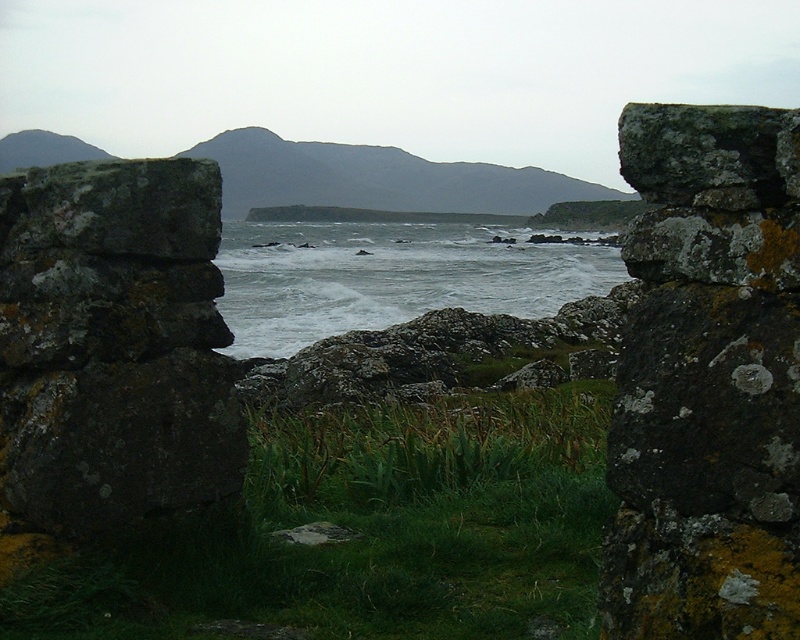
Is point (376, 317) positioned in front of point (712, 108)?

No, (376, 317) is behind (712, 108).

Is white frothy water at center wider than lichen-covered rock at upper right?

Yes, white frothy water at center is wider than lichen-covered rock at upper right.

Who is more forward, (478,236) or (700,134)?

Point (700,134)

What are the coordinates of `white frothy water at center` in the screenshot? It's located at (389, 276).

Based on the photo, between rusty stone wall at right and lichen-covered rock at upper right, which one appears on the right side from the viewer's perspective?

rusty stone wall at right

From the picture: Who is positioned more to the left, rusty stone wall at right or lichen-covered rock at upper right?

Positioned to the left is lichen-covered rock at upper right.

The height and width of the screenshot is (640, 800). Describe the element at coordinates (708, 380) in the screenshot. I see `rusty stone wall at right` at that location.

This screenshot has width=800, height=640. I want to click on rusty stone wall at right, so click(x=708, y=380).

Who is positioned more to the right, green grassy patch at center or white frothy water at center?

green grassy patch at center is more to the right.

What are the coordinates of `green grassy patch at center` in the screenshot? It's located at (364, 532).

Which is behind, point (474, 584) or point (624, 276)?

The point (624, 276) is more distant.

Where is `green grassy patch at center`? This screenshot has width=800, height=640. green grassy patch at center is located at coordinates (364, 532).